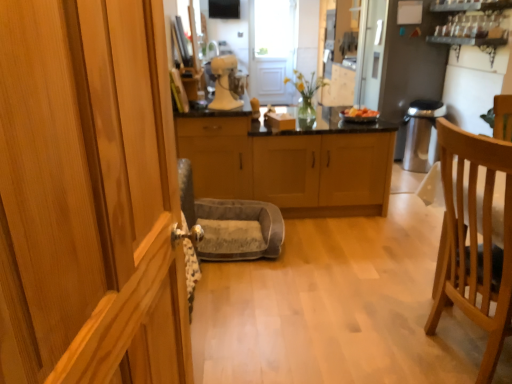
Locate an element on the screen. light brown wooden chair at right is located at coordinates (475, 238).

Describe the element at coordinates (306, 92) in the screenshot. This screenshot has width=512, height=384. I see `translucent glass vase at center` at that location.

This screenshot has height=384, width=512. Describe the element at coordinates (231, 224) in the screenshot. I see `velvet gray pet bed at center` at that location.

Find the location of a particular element. light brown wood cabinet at center, which appears as the 1th cabinetry when viewed from the front is located at coordinates (90, 193).

You are a GUI agent. You are given a task and a screenshot of the screen. Output one action in this format:
    pyautogui.click(x=<x>, y=<y>)
    Task: Click on the smooth plastic bowl at center
    This screenshot has width=512, height=384.
    Given the screenshot: What is the action you would take?
    pyautogui.click(x=359, y=114)

This screenshot has height=384, width=512. I want to click on satin silver refrigerator at upper right, so click(x=410, y=65).

Who is shorter, velvet gray pet bed at center or matte gray cabinet at center, which ranks as the first cabinetry in left-to-right order?

With less height is velvet gray pet bed at center.

Relative to matte gray cabinet at center, which ranks as the first cabinetry in left-to-right order, is velvet gray pet bed at center in front or behind?

Visually, velvet gray pet bed at center is located in front of matte gray cabinet at center, which ranks as the first cabinetry in left-to-right order.

How far apart are velvet gray pet bed at center and matte gray cabinet at center, the second cabinetry in the front-to-back sequence?

velvet gray pet bed at center and matte gray cabinet at center, the second cabinetry in the front-to-back sequence, are 29.50 centimeters apart.

Can you tell me how much velvet gray pet bed at center and matte gray cabinet at center, which is counted as the 3th cabinetry, starting from the right, differ in facing direction?

They differ by 90.2 degrees in their facing directions.

In order to click on rocking chair lying on the right of white matte stand mixer at center in this screenshot , I will do click(231, 224).

Looking at this image, is white matte stand mixer at center aimed at velvet gray pet bed at center?

No, white matte stand mixer at center is not oriented towards velvet gray pet bed at center.

Does white matte stand mixer at center have a greater height compared to velvet gray pet bed at center?

Yes.

Considering the sizes of white matte stand mixer at center and velvet gray pet bed at center in the image, is white matte stand mixer at center wider or thinner than velvet gray pet bed at center?

Clearly, white matte stand mixer at center has less width compared to velvet gray pet bed at center.

Based on the photo, is white matte stand mixer at center to the left or to the right of light brown wooden chair at right in the image?

In the image, white matte stand mixer at center appears on the left side of light brown wooden chair at right.

Which of these two, white matte stand mixer at center or light brown wooden chair at right, stands shorter?

Standing shorter between the two is white matte stand mixer at center.

Is point (221, 76) positioned behind point (495, 167)?

That is True.

In terms of width, does white matte stand mixer at center look wider or thinner when compared to light brown wooden chair at right?

Clearly, white matte stand mixer at center has less width compared to light brown wooden chair at right.

Which of these two, light brown wood cabinet at center, which appears as the 1th cabinetry when viewed from the front, or light wood cabinetry at center, which ranks as the 1th cabinetry in back-to-front order, is smaller?

Smaller between the two is light brown wood cabinet at center, which appears as the 1th cabinetry when viewed from the front.

Based on the photo, is light brown wood cabinet at center, which is the third cabinetry in back-to-front order, positioned before light wood cabinetry at center, which ranks as the 1th cabinetry in back-to-front order?

That is True.

Considering the sizes of objects light brown wood cabinet at center, which is the third cabinetry in back-to-front order, and light wood cabinetry at center, the 3th cabinetry in the left-to-right sequence, in the image provided, who is taller, light brown wood cabinet at center, which is the third cabinetry in back-to-front order, or light wood cabinetry at center, the 3th cabinetry in the left-to-right sequence,?

light brown wood cabinet at center, which is the third cabinetry in back-to-front order, is taller.

Which is closer to the camera, (58, 354) or (292, 161)?

Point (58, 354) is closer to the camera than point (292, 161).

Does smooth plastic bowl at center have a greater height compared to matte gray cabinet at center, the second cabinetry when ordered from back to front?

In fact, smooth plastic bowl at center may be shorter than matte gray cabinet at center, the second cabinetry when ordered from back to front.

Which is behind, smooth plastic bowl at center or matte gray cabinet at center, which ranks as the first cabinetry in left-to-right order?

smooth plastic bowl at center is further away from the camera.

How distant is smooth plastic bowl at center from matte gray cabinet at center, the second cabinetry when ordered from back to front?

smooth plastic bowl at center and matte gray cabinet at center, the second cabinetry when ordered from back to front, are 1.03 meters apart from each other.

From a real-world perspective, which cabinetry is the 1st one underneath the smooth plastic bowl at center? Please provide its 2D coordinates.

[(217, 155)]

Could satin black trash can at right be considered to be inside matte gray cabinet at center, which ranks as the first cabinetry in left-to-right order?

That's incorrect, satin black trash can at right is not inside matte gray cabinet at center, which ranks as the first cabinetry in left-to-right order.

Can you confirm if matte gray cabinet at center, which ranks as the first cabinetry in left-to-right order, is positioned to the left of satin black trash can at right?

Correct, you'll find matte gray cabinet at center, which ranks as the first cabinetry in left-to-right order, to the left of satin black trash can at right.

From the image's perspective, is matte gray cabinet at center, the second cabinetry when ordered from back to front, located beneath satin black trash can at right?

Incorrect, from the image's perspective, matte gray cabinet at center, the second cabinetry when ordered from back to front, is higher than satin black trash can at right.

Is light brown wooden chair at right to the left of velvet gray pet bed at center from the viewer's perspective?

No, light brown wooden chair at right is not to the left of velvet gray pet bed at center.

Consider the image. Considering the sizes of objects light brown wooden chair at right and velvet gray pet bed at center in the image provided, who is wider, light brown wooden chair at right or velvet gray pet bed at center?

light brown wooden chair at right.

Is light brown wooden chair at right facing away from velvet gray pet bed at center?

That's not correct — light brown wooden chair at right is not looking away from velvet gray pet bed at center.

Which of these two, light brown wooden chair at right or velvet gray pet bed at center, is smaller?

velvet gray pet bed at center is smaller.

Where is `the 2nd cabinetry above the velvet gray pet bed at center (from a real-world perspective)`? the 2nd cabinetry above the velvet gray pet bed at center (from a real-world perspective) is located at coordinates (217, 155).

At what (x,y) coordinates should I click in order to perform the action: click on kitchen appliance on the left side of velvet gray pet bed at center. Please return your answer as a coordinate pair (x, y). Looking at the image, I should click on (223, 83).

In the scene shown: Considering their positions, is light wood cabinetry at center, the 3th cabinetry in the left-to-right sequence, positioned further to velvet gray pet bed at center than smooth plastic bowl at center?

Based on the image, smooth plastic bowl at center appears to be further to velvet gray pet bed at center.

Based on their spatial positions, is white matte stand mixer at center or smooth plastic bowl at center further from light brown wooden chair at right?

The object further to light brown wooden chair at right is white matte stand mixer at center.

Looking at this image, which object lies nearer to the anchor point light brown wooden chair at right, satin silver refrigerator at upper right or satin black trash can at right?

satin black trash can at right lies closer to light brown wooden chair at right than the other object.

Considering their positions, is light brown wooden chair at right positioned further to smooth plastic bowl at center than white matte stand mixer at center?

Based on the image, light brown wooden chair at right appears to be further to smooth plastic bowl at center.

Looking at the image, which one is located closer to satin black trash can at right, light brown wood cabinet at center, which is counted as the 2th cabinetry, starting from the left, or white matte stand mixer at center?

Based on the image, white matte stand mixer at center appears to be nearer to satin black trash can at right.

From the image, which object appears to be nearer to light brown wood cabinet at center, the 2th cabinetry viewed from the right, smooth plastic bowl at center or translucent glass vase at center?

Based on the image, translucent glass vase at center appears to be nearer to light brown wood cabinet at center, the 2th cabinetry viewed from the right.

Looking at this image, estimate the real-world distances between objects in this image. Which object is closer to smooth plastic bowl at center, light brown wood cabinet at center, which is counted as the 2th cabinetry, starting from the left, or satin silver refrigerator at upper right?

The object closer to smooth plastic bowl at center is satin silver refrigerator at upper right.

Which object lies further to the anchor point satin silver refrigerator at upper right, translucent glass vase at center or light wood cabinetry at center, the 3th cabinetry in the left-to-right sequence?

light wood cabinetry at center, the 3th cabinetry in the left-to-right sequence, is positioned further to the anchor satin silver refrigerator at upper right.

Locate an element on the screen. rocking chair located between matte gray cabinet at center, the second cabinetry in the front-to-back sequence, and satin black trash can at right in the left-right direction is located at coordinates (231, 224).

I want to click on houseplant located between matte gray cabinet at center, the second cabinetry in the front-to-back sequence, and light wood cabinetry at center, arranged as the first cabinetry when viewed from the right, in the left-right direction, so click(x=306, y=92).

Image resolution: width=512 pixels, height=384 pixels. I want to click on trash bin/can between light brown wood cabinet at center, which appears as the 1th cabinetry when viewed from the front, and satin silver refrigerator at upper right from front to back, so 420,133.

Where is `cabinetry between velvet gray pet bed at center and smooth plastic bowl at center`? This screenshot has height=384, width=512. cabinetry between velvet gray pet bed at center and smooth plastic bowl at center is located at coordinates (324, 169).